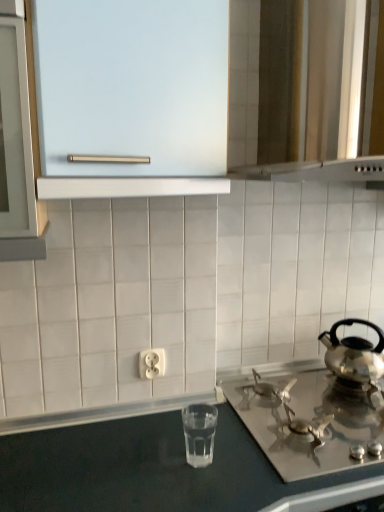
Question: Is metallic silver vent at upper right bigger or smaller than white plastic outlet at center?

Choices:
 (A) big
 (B) small

Answer: (A)

Question: From a real-world perspective, relative to white plastic outlet at center, is metallic silver vent at upper right vertically above or below?

Choices:
 (A) above
 (B) below

Answer: (A)

Question: Estimate the real-world distances between objects in this image. Which object is farther from the clear glass water at lower center?

Choices:
 (A) frosted glass cabinet at upper center
 (B) shiny silver kettle at right
 (C) satin silver gas stove at lower right
 (D) metallic silver vent at upper right
 (E) white plastic outlet at center

Answer: (D)

Question: Considering the real-world distances, which object is farthest from the white plastic outlet at center?

Choices:
 (A) frosted glass cabinet at upper center
 (B) clear glass water at lower center
 (C) shiny silver kettle at right
 (D) metallic silver vent at upper right
 (E) satin silver gas stove at lower right

Answer: (D)